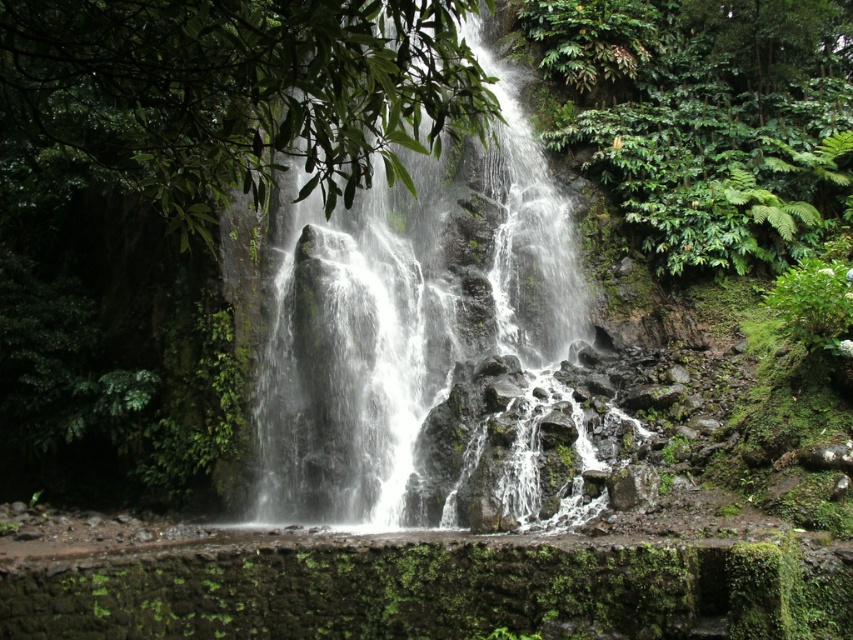
You are a photographer planning to capture the waterfall scene. You want to ensure that the white frothy water at center and the green leafy foliage at center are both visible in your shot. Which object should you focus on to frame the wider part of the scene?

You should focus on the green leafy foliage at center because its width is greater than the white frothy water at center, making it the wider object in the scene.

You are standing on the stone ledge in front of the waterfall. You notice both the white frothy water at center and the green leafy foliage at center. Which object is positioned more to your right side?

The white frothy water at center is to the right of the green leafy foliage at center, so it is positioned more to your right side.

You are a hiker standing at the stone ledge in the foreground. You want to reach the green leafy foliage at center without getting wet. Can you walk directly to it from the white frothy water at center?

The white frothy water at center is 4.38 meters away from the green leafy foliage at center. Since the distance is significant, you can walk around the area to reach the green leafy foliage at center without stepping into the water.